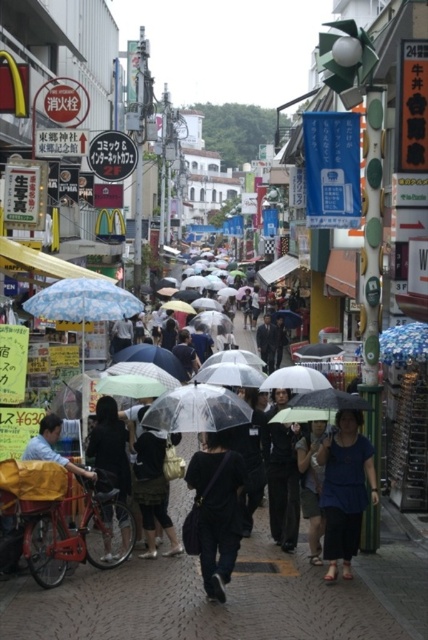
Question: Does black matte bag at center have a lesser width compared to dark blue fabric shirt at center?

Choices:
 (A) yes
 (B) no

Answer: (B)

Question: Among these points, which one is farthest from the camera?

Choices:
 (A) (213, 570)
 (B) (347, 490)

Answer: (B)

Question: Where is black matte bag at center located in relation to dark blue fabric shirt at center in the image?

Choices:
 (A) below
 (B) above

Answer: (A)

Question: Is black matte bag at center closer to the viewer compared to dark blue fabric shirt at center?

Choices:
 (A) yes
 (B) no

Answer: (A)